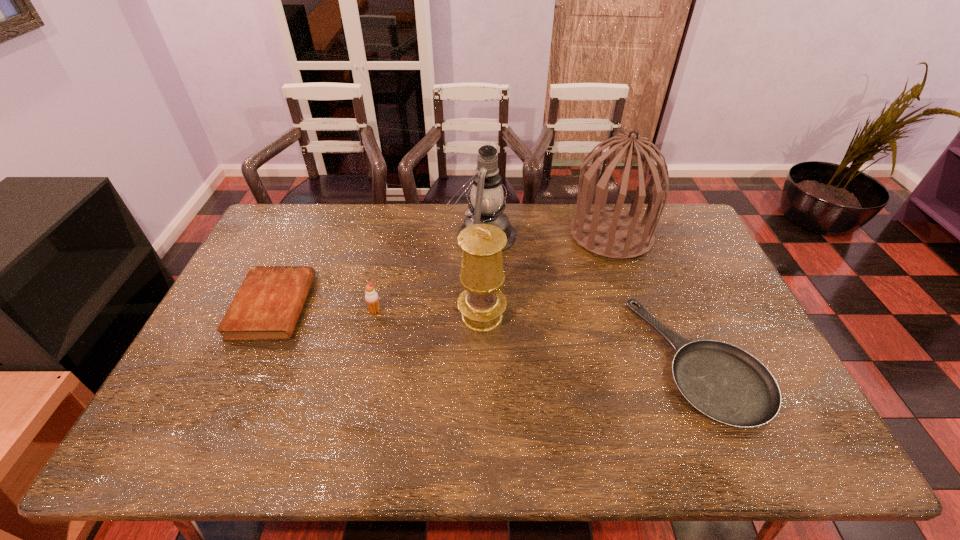
Identify the location of object present at the far right corner. (609, 232).

You are a GUI agent. You are given a task and a screenshot of the screen. Output one action in this format:
    pyautogui.click(x=<x>, y=<y>)
    Task: Click on the object present at the near right corner
    The height and width of the screenshot is (540, 960).
    Given the screenshot: What is the action you would take?
    pos(725,383)

In the image, there is a desktop. Where is `vacant region at the far edge`? vacant region at the far edge is located at coordinates (516, 207).

Where is `vacant space at the near edge`? vacant space at the near edge is located at coordinates (733, 460).

Find the location of a particular element. Image resolution: width=960 pixels, height=540 pixels. free spot at the left edge of the desktop is located at coordinates (217, 343).

You are a GUI agent. You are given a task and a screenshot of the screen. Output one action in this format:
    pyautogui.click(x=<x>, y=<y>)
    Task: Click on the free point at the right edge
    This screenshot has width=960, height=540.
    Given the screenshot: What is the action you would take?
    pyautogui.click(x=695, y=292)

Where is `vacant space at the far left corner of the desktop`? Image resolution: width=960 pixels, height=540 pixels. vacant space at the far left corner of the desktop is located at coordinates (283, 235).

This screenshot has width=960, height=540. Identify the location of free spot at the far right corner of the desktop. (674, 217).

Image resolution: width=960 pixels, height=540 pixels. In order to click on free point between the frying pan and the third shortest object in this screenshot , I will do `click(537, 335)`.

The width and height of the screenshot is (960, 540). In order to click on vacant point located between the fifth object from right to left and the nearer oil lamp in this screenshot , I will do `click(428, 314)`.